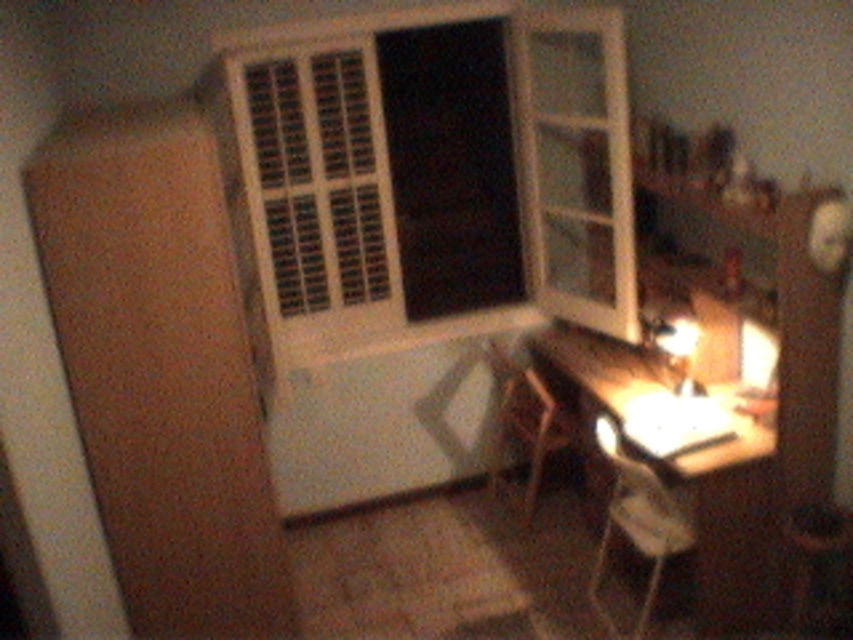
You are sitting in a chair at the wooden desk at lower right, and you want to place a book on the white glossy lamp at lower right. Can you do this without moving the lamp?

The wooden desk at lower right is taller than the white glossy lamp at lower right, so placing a book directly on the white glossy lamp at lower right would require reaching over the desk since the desk is higher than the lamp.

You are sitting at the desk in the study and want to move to the chair. Which chair, the white plastic chair at lower right or the wooden stool at lower right, is closer to the desk surface?

The wooden stool at lower right is closer to the desk surface because the white plastic chair at lower right is positioned above it.